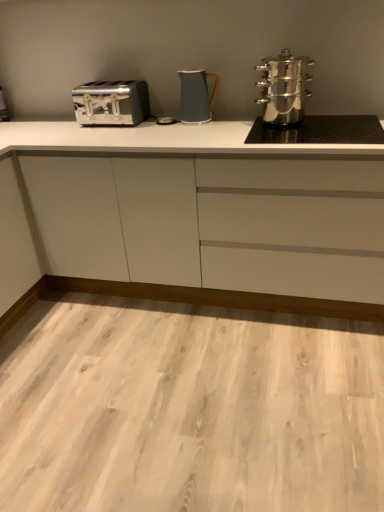
The width and height of the screenshot is (384, 512). Find the location of `free point in front of satin chrome toaster at left`. free point in front of satin chrome toaster at left is located at coordinates (106, 134).